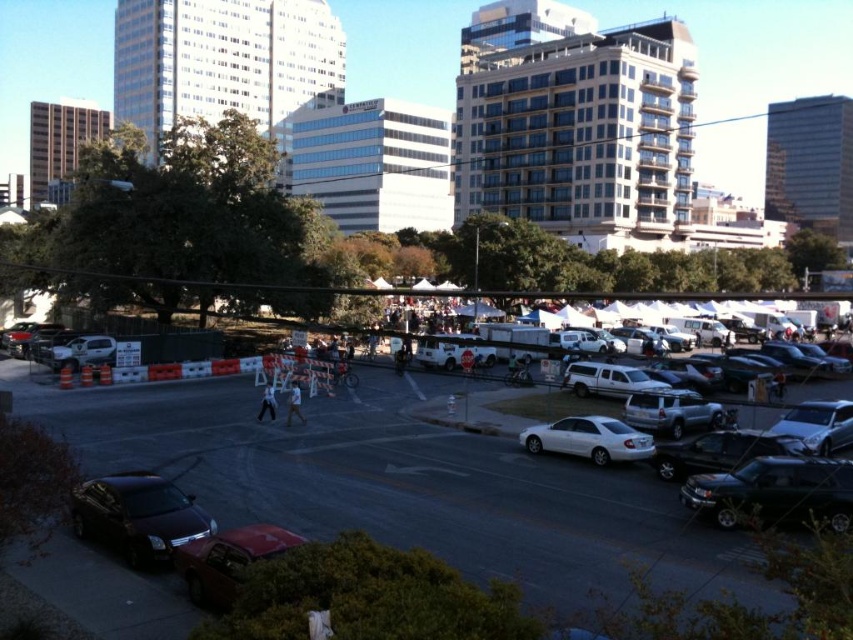
Does satin silver suv at lower right have a greater height compared to matte white truck at left?

Indeed, satin silver suv at lower right has a greater height compared to matte white truck at left.

Where is `satin silver suv at lower right`? The height and width of the screenshot is (640, 853). satin silver suv at lower right is located at coordinates (670, 412).

Locate an element on the screen. The height and width of the screenshot is (640, 853). satin silver suv at lower right is located at coordinates (670, 412).

Looking at this image, is metallic red car at lower left closer to camera compared to shiny black sedan at center right?

Yes, metallic red car at lower left is closer to the viewer.

Does metallic red car at lower left have a lesser width compared to shiny black sedan at center right?

No.

Is point (189, 592) closer to camera compared to point (680, 456)?

Yes, point (189, 592) is in front of point (680, 456).

You are a GUI agent. You are given a task and a screenshot of the screen. Output one action in this format:
    pyautogui.click(x=<x>, y=<y>)
    Task: Click on the metallic red car at lower left
    
    Given the screenshot: What is the action you would take?
    pyautogui.click(x=227, y=561)

Is shiny black suv at lower right closer to the viewer compared to white matte sedan at center?

Yes.

Which is in front, point (827, 524) or point (618, 442)?

Point (827, 524) is more forward.

The height and width of the screenshot is (640, 853). I want to click on shiny black suv at lower right, so click(x=775, y=492).